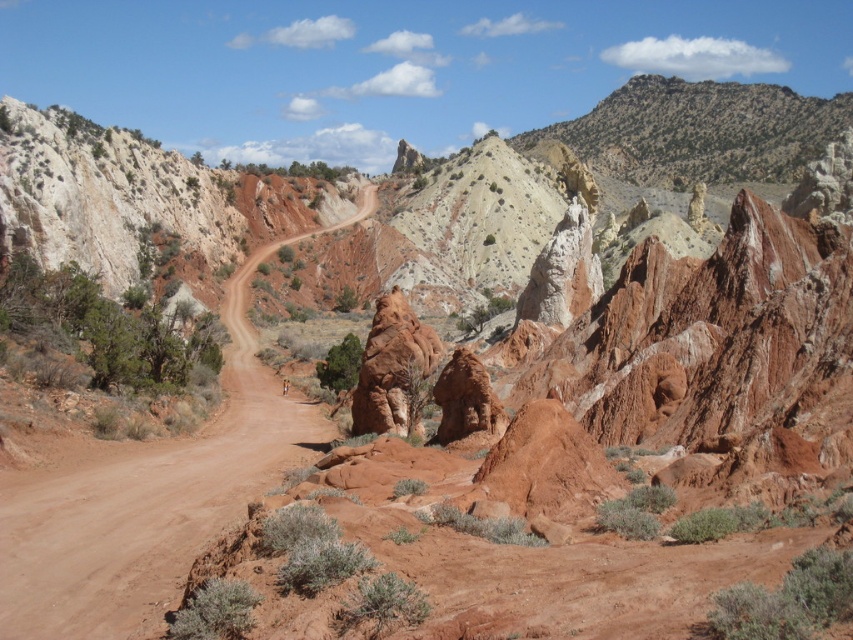
Question: Among these objects, which one is nearest to the camera?

Choices:
 (A) dusty dirt road at center
 (B) rustic sandstone rock at center

Answer: (A)

Question: Observing the image, what is the correct spatial positioning of dusty dirt road at center in reference to rustic sandstone rock at center?

Choices:
 (A) right
 (B) left

Answer: (B)

Question: From the image, what is the correct spatial relationship of dusty dirt road at center in relation to rustic sandstone rock at center?

Choices:
 (A) left
 (B) right

Answer: (A)

Question: Can you confirm if dusty dirt road at center is positioned below rustic sandstone rock at center?

Choices:
 (A) no
 (B) yes

Answer: (B)

Question: Which object appears closest to the camera in this image?

Choices:
 (A) dusty dirt road at center
 (B) rustic sandstone rock at center

Answer: (A)